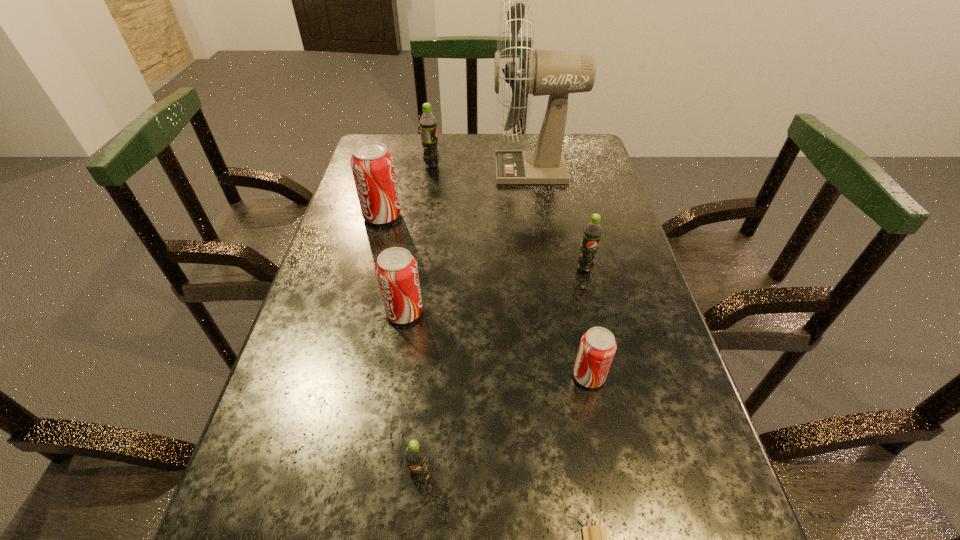
Choose which object is the sixth nearest neighbor to the farthest soda. Please provide its 2D coordinates. Your answer should be formatted as a tuple, i.e. [(x, y)], where the tuple contains the x and y coordinates of a point satisfying the conditions above.

[(415, 454)]

Select which object appears as the fourth closest to the leftmost object. Please provide its 2D coordinates. Your answer should be formatted as a tuple, i.e. [(x, y)], where the tuple contains the x and y coordinates of a point satisfying the conditions above.

[(592, 232)]

Choose which soda is the fifth nearest neighbor to the second smallest red soda can. Please provide its 2D coordinates. Your answer should be formatted as a tuple, i.e. [(x, y)], where the tuple contains the x and y coordinates of a point satisfying the conditions above.

[(428, 123)]

Point out which soda is positioned as the second nearest to the farthest green soda. Please provide its 2D coordinates. Your answer should be formatted as a tuple, i.e. [(x, y)], where the tuple contains the x and y coordinates of a point satisfying the conditions above.

[(396, 270)]

Identify which red soda can is the nearest to the fifth nearest soda. Please provide its 2D coordinates. Your answer should be formatted as a tuple, i.e. [(x, y)], where the tuple contains the x and y coordinates of a point satisfying the conditions above.

[(396, 270)]

Select which red soda can appears as the second closest to the leftmost object. Please provide its 2D coordinates. Your answer should be formatted as a tuple, i.e. [(x, y)], where the tuple contains the x and y coordinates of a point satisfying the conditions above.

[(597, 348)]

The image size is (960, 540). I want to click on green soda that is the second closest one to the rightmost red soda can, so click(415, 454).

Identify which green soda is the closest to the sixth nearest object. Please provide its 2D coordinates. Your answer should be formatted as a tuple, i.e. [(x, y)], where the tuple contains the x and y coordinates of a point satisfying the conditions above.

[(428, 123)]